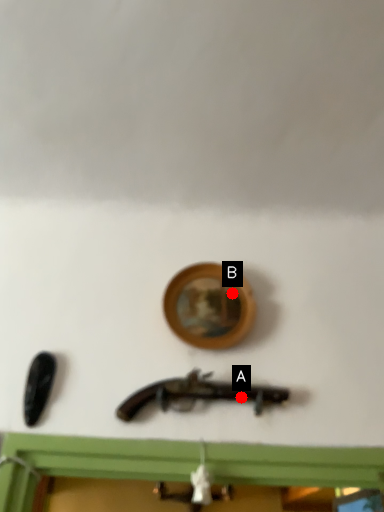
Question: Two points are circled on the image, labeled by A and B beside each circle. Which point appears farthest from the camera in this image?

Choices:
 (A) A is further
 (B) B is further

Answer: (B)